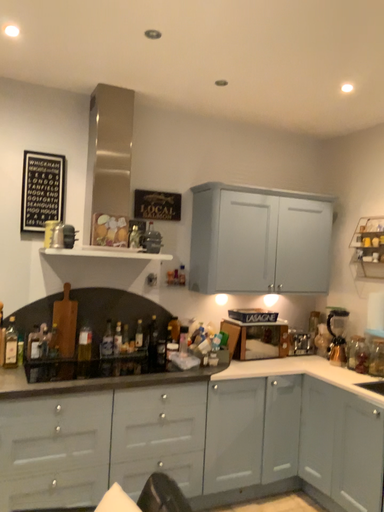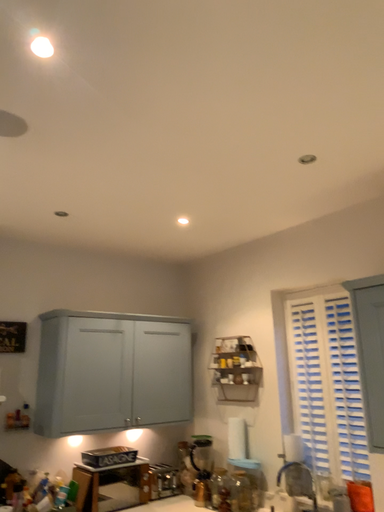
Question: Which way did the camera rotate in the video?

Choices:
 (A) rotated upward
 (B) rotated downward

Answer: (A)